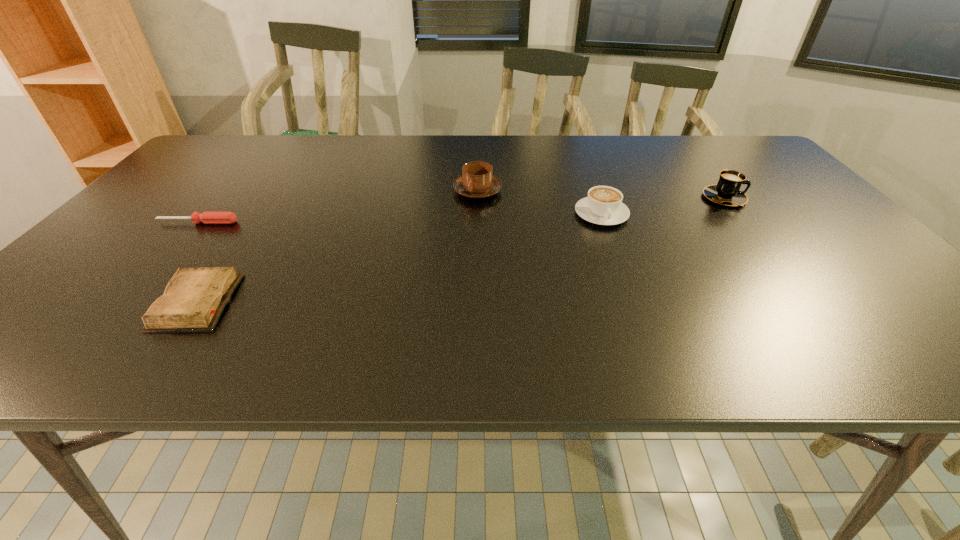
The width and height of the screenshot is (960, 540). I want to click on vacant space located on the front of the screwdriver, so click(x=114, y=321).

You are a GUI agent. You are given a task and a screenshot of the screen. Output one action in this format:
    pyautogui.click(x=<x>, y=<y>)
    Task: Click on the object positioned at the near edge
    
    Given the screenshot: What is the action you would take?
    pyautogui.click(x=194, y=299)

In order to click on object that is at the left edge in this screenshot , I will do `click(206, 217)`.

You are a GUI agent. You are given a task and a screenshot of the screen. Output one action in this format:
    pyautogui.click(x=<x>, y=<y>)
    Task: Click on the free space at the far edge of the desktop
    The height and width of the screenshot is (540, 960).
    Given the screenshot: What is the action you would take?
    [273, 161]

I want to click on vacant area at the near edge, so click(x=273, y=332).

Identify the location of vacant region at the right edge of the desktop. This screenshot has width=960, height=540. (794, 192).

In the image, there is a desktop. At what (x,y) coordinates should I click in order to perform the action: click on vacant space at the near left corner. Please return your answer as a coordinate pair (x, y). The height and width of the screenshot is (540, 960). Looking at the image, I should click on (24, 358).

Where is `unoccupied area between the rightmost object and the diary`? The width and height of the screenshot is (960, 540). unoccupied area between the rightmost object and the diary is located at coordinates (460, 250).

The width and height of the screenshot is (960, 540). I want to click on vacant area that lies between the leftmost cappuccino and the fourth object from left to right, so click(540, 202).

Where is `free space that is in between the screwdriver and the nearest object`? This screenshot has width=960, height=540. free space that is in between the screwdriver and the nearest object is located at coordinates (197, 262).